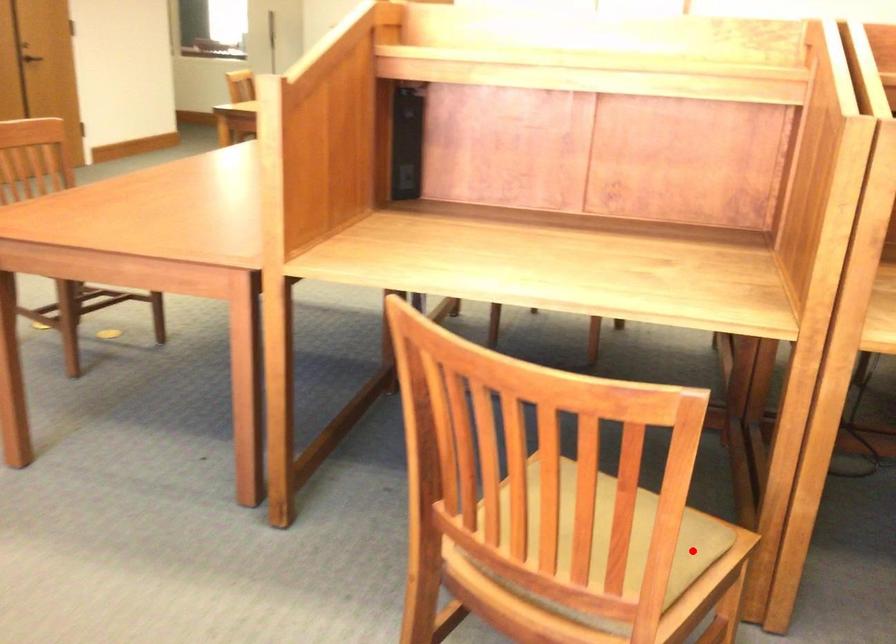
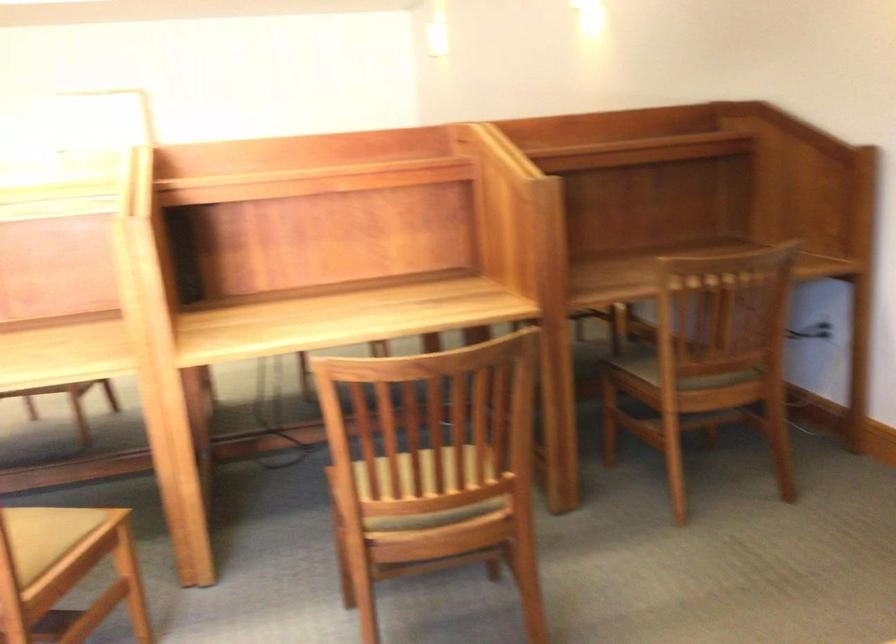
In the second image, find the point that corresponds to the highlighted location in the first image.

(62, 536)